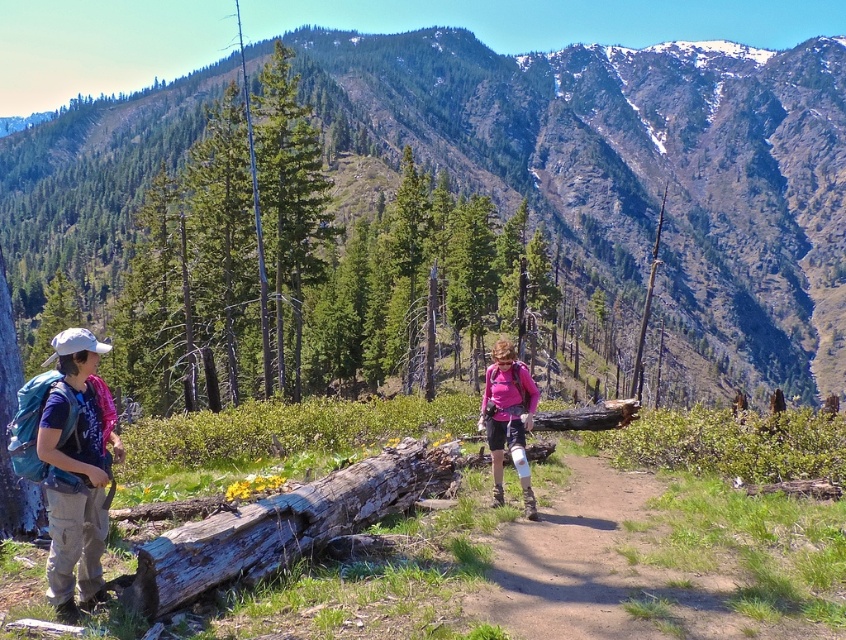
Does green forested mountain at upper center have a larger size compared to weathered wood log at center?

Correct, green forested mountain at upper center is larger in size than weathered wood log at center.

Does green forested mountain at upper center appear under weathered wood log at center?

Incorrect, green forested mountain at upper center is not positioned below weathered wood log at center.

Image resolution: width=846 pixels, height=640 pixels. Describe the element at coordinates (630, 168) in the screenshot. I see `green forested mountain at upper center` at that location.

The image size is (846, 640). Find the location of `green forested mountain at upper center`. green forested mountain at upper center is located at coordinates (630, 168).

Between brown dirt path at center and weathered wood log at center, which one has more height?

Standing taller between the two is weathered wood log at center.

Does point (567, 534) come closer to viewer compared to point (438, 476)?

Yes.

Image resolution: width=846 pixels, height=640 pixels. I want to click on brown dirt path at center, so click(x=613, y=570).

Between green forested mountain at upper center and pink fabric at center, which one has less height?

Standing shorter between the two is pink fabric at center.

Is point (635, 280) closer to camera compared to point (508, 420)?

No, it is behind (508, 420).

Identify the location of green forested mountain at upper center. The image size is (846, 640). (630, 168).